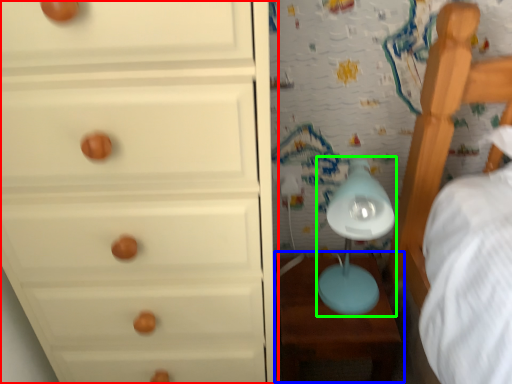
Question: Considering the real-world distances, which object is farthest from chest of drawers (highlighted by a red box)? table (highlighted by a blue box) or table lamp (highlighted by a green box)?

Choices:
 (A) table
 (B) table lamp

Answer: (A)